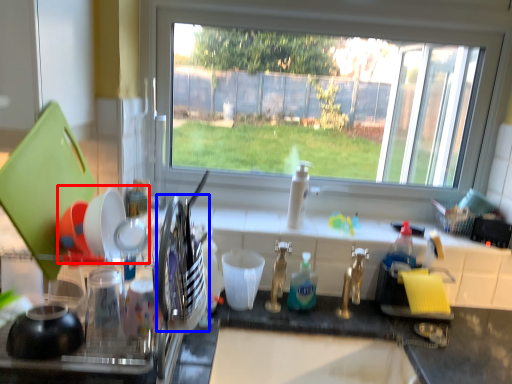
Question: Which object is further to the camera taking this photo, tableware (highlighted by a red box) or tableware (highlighted by a blue box)?

Choices:
 (A) tableware
 (B) tableware

Answer: (A)